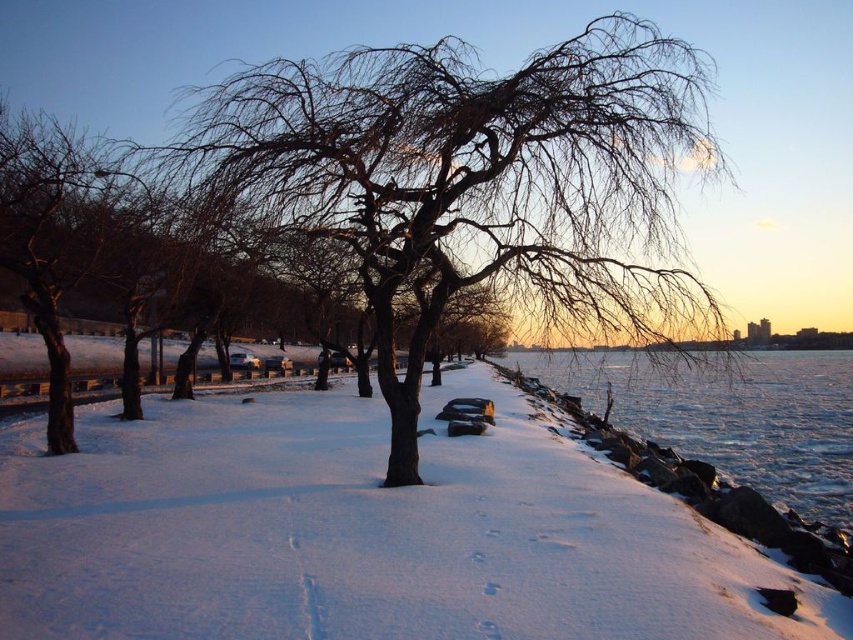
Consider the image. You are an artist trying to sketch the winter scene. You notice the bare branches at center and the frozen ice at lower right. Which object should you draw first if you want to follow the principle of starting with the thinner elements?

You should draw the bare branches at center first because it is thinner than the frozen ice at lower right, aligning with the principle of starting with thinner elements.